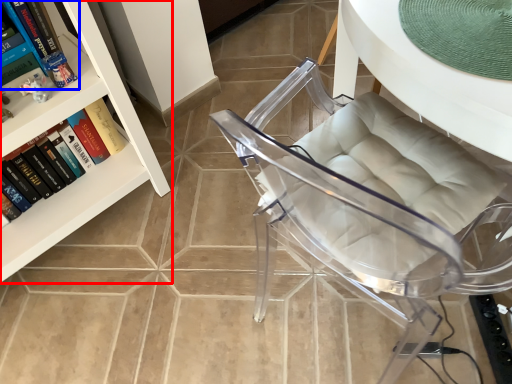
Question: Which point is closer to the camera, bookcase (highlighted by a red box) or book (highlighted by a blue box)?

Choices:
 (A) bookcase
 (B) book

Answer: (A)